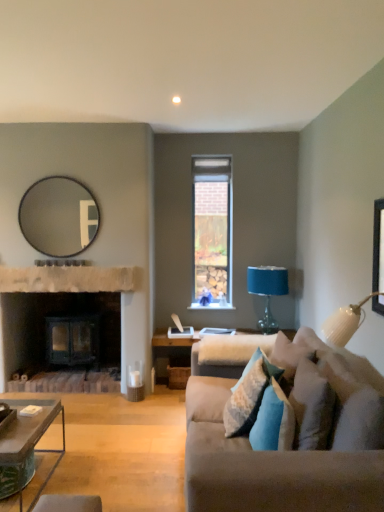
Question: Considering the relative sizes of rustic stone fireplace at center and black matte picture frame at upper right in the image provided, is rustic stone fireplace at center wider than black matte picture frame at upper right?

Choices:
 (A) yes
 (B) no

Answer: (A)

Question: Is rustic stone fireplace at center outside black matte picture frame at upper right?

Choices:
 (A) yes
 (B) no

Answer: (A)

Question: From a real-world perspective, does rustic stone fireplace at center stand above black matte picture frame at upper right?

Choices:
 (A) no
 (B) yes

Answer: (A)

Question: Does rustic stone fireplace at center appear on the right side of black matte picture frame at upper right?

Choices:
 (A) yes
 (B) no

Answer: (B)

Question: Can you confirm if rustic stone fireplace at center is taller than black matte picture frame at upper right?

Choices:
 (A) no
 (B) yes

Answer: (A)

Question: Considering the positions of velvet beige couch at right and rustic stone fireplace at center in the image, is velvet beige couch at right bigger or smaller than rustic stone fireplace at center?

Choices:
 (A) small
 (B) big

Answer: (B)

Question: In terms of width, does velvet beige couch at right look wider or thinner when compared to rustic stone fireplace at center?

Choices:
 (A) wide
 (B) thin

Answer: (A)

Question: Visually, is velvet beige couch at right positioned to the left or to the right of rustic stone fireplace at center?

Choices:
 (A) right
 (B) left

Answer: (A)

Question: From the image's perspective, is velvet beige couch at right above or below rustic stone fireplace at center?

Choices:
 (A) below
 (B) above

Answer: (A)

Question: Looking at the image, does green textured coffee table at lower left seem bigger or smaller compared to matte black mirror at upper left?

Choices:
 (A) big
 (B) small

Answer: (A)

Question: From the image's perspective, relative to matte black mirror at upper left, is green textured coffee table at lower left above or below?

Choices:
 (A) above
 (B) below

Answer: (B)

Question: Would you say green textured coffee table at lower left is to the left or to the right of matte black mirror at upper left in the picture?

Choices:
 (A) right
 (B) left

Answer: (A)

Question: Considering the positions of green textured coffee table at lower left and matte black mirror at upper left in the image, is green textured coffee table at lower left taller or shorter than matte black mirror at upper left?

Choices:
 (A) tall
 (B) short

Answer: (B)

Question: Based on their sizes in the image, would you say blue velvet pillow at lower right, the 1th pillow in the front-to-back sequence, is bigger or smaller than green textured coffee table at lower left?

Choices:
 (A) big
 (B) small

Answer: (B)

Question: Looking at their shapes, would you say blue velvet pillow at lower right, the 1th pillow in the front-to-back sequence, is wider or thinner than green textured coffee table at lower left?

Choices:
 (A) wide
 (B) thin

Answer: (B)